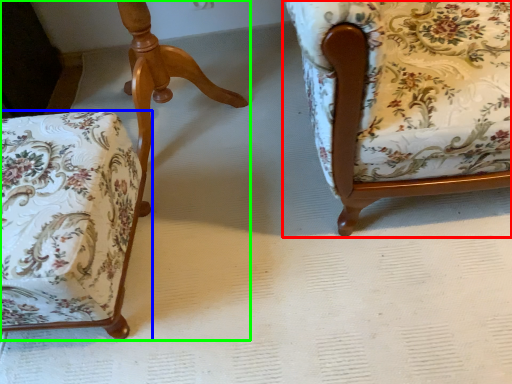
Question: Which is nearer to the chair (highlighted by a red box)? chair (highlighted by a blue box) or chair (highlighted by a green box).

Choices:
 (A) chair
 (B) chair

Answer: (A)